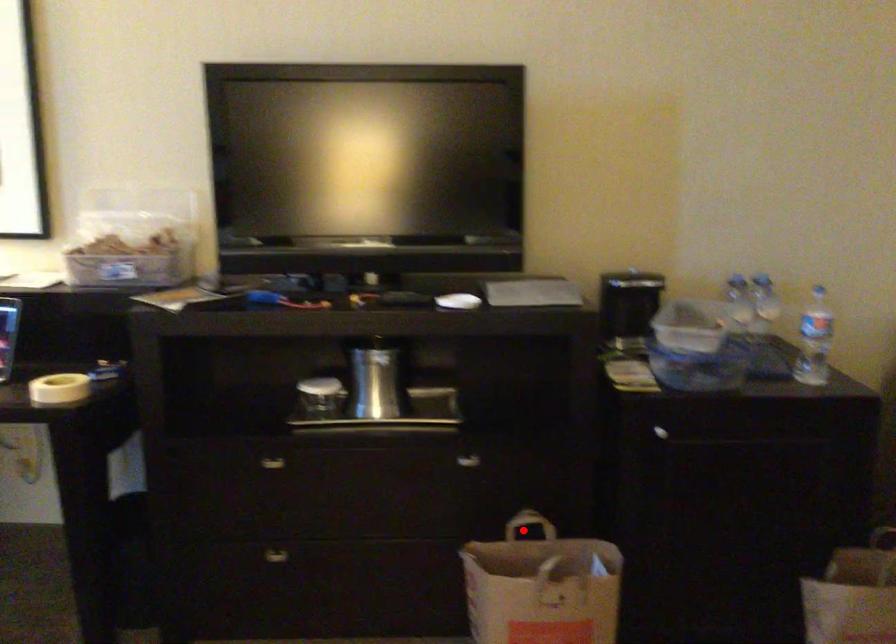
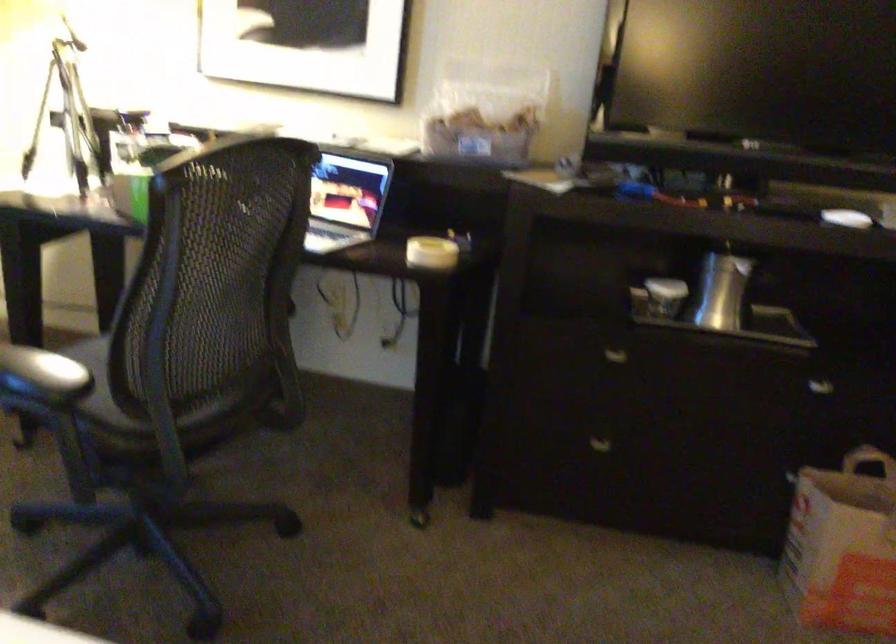
The point at the highlighted location is marked in the first image. Where is the corresponding point in the second image?

(867, 460)